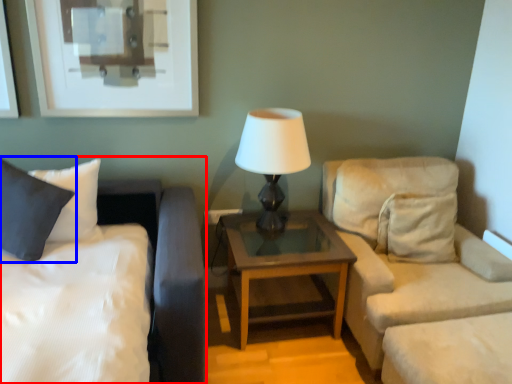
Question: Which point is further to the camera, bed (highlighted by a red box) or pillow (highlighted by a blue box)?

Choices:
 (A) bed
 (B) pillow

Answer: (B)